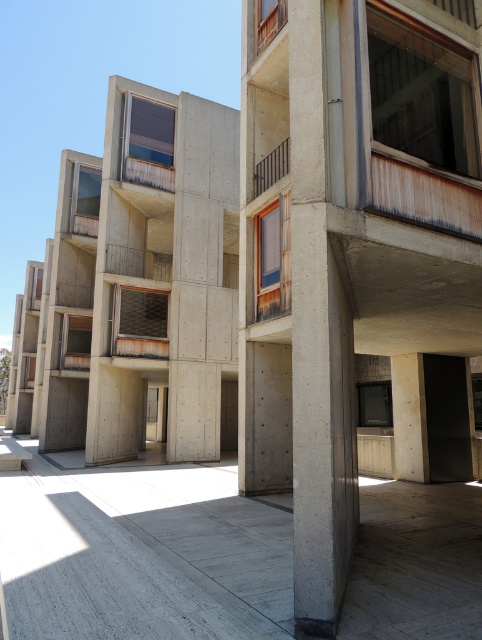
Does gray concrete at center appear on the left side of concrete at center?

Correct, you'll find gray concrete at center to the left of concrete at center.

Which is above, gray concrete at center or concrete at center?

concrete at center is above.

The image size is (482, 640). What are the coordinates of `gray concrete at center` in the screenshot? It's located at (143, 554).

Where is `gray concrete at center`? The image size is (482, 640). gray concrete at center is located at coordinates (143, 554).

Is concrete/rough column at center bigger than concrete at center?

Yes, concrete/rough column at center is bigger than concrete at center.

Can you confirm if concrete/rough column at center is shorter than concrete at center?

Incorrect, concrete/rough column at center's height does not fall short of concrete at center's.

Locate an element on the screen. The width and height of the screenshot is (482, 640). concrete/rough column at center is located at coordinates (321, 426).

Does concrete/rough column at center appear on the right side of rustic metal balcony at upper center?

Correct, you'll find concrete/rough column at center to the right of rustic metal balcony at upper center.

Can you confirm if concrete/rough column at center is wider than rustic metal balcony at upper center?

Yes.

Who is more forward, (294,580) or (279,156)?

Point (294,580) is more forward.

Locate an element on the screen. The image size is (482, 640). concrete/rough column at center is located at coordinates (321, 426).